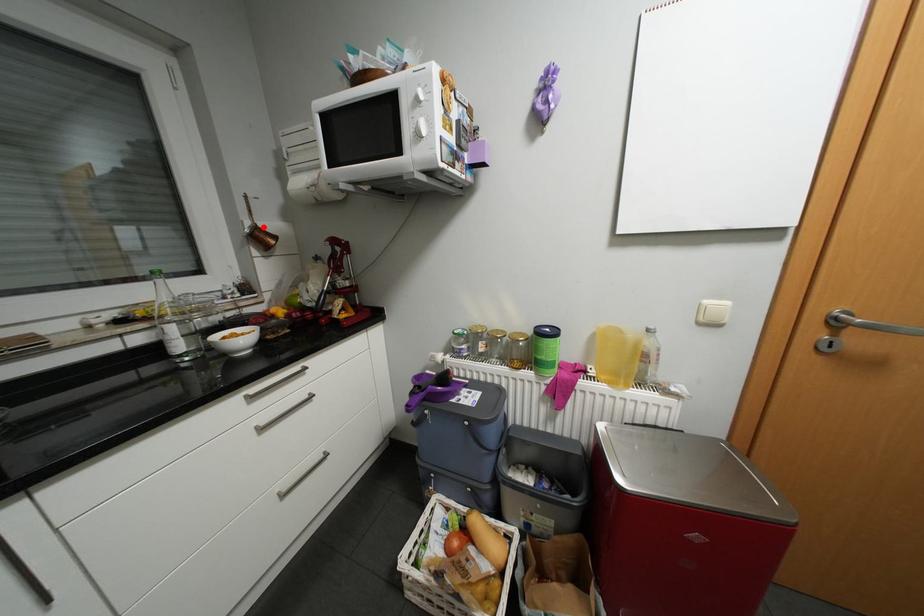
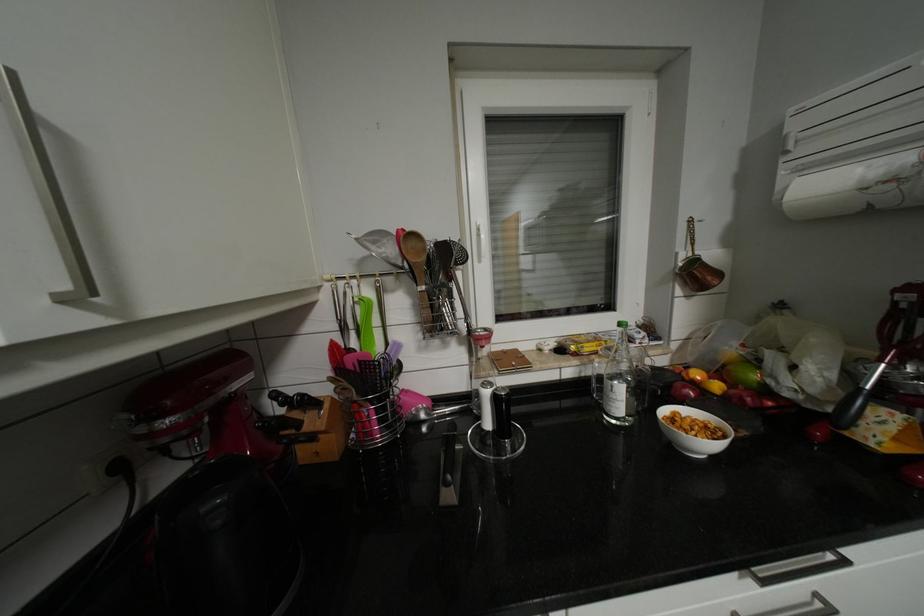
Locate, in the second image, the point that corresponds to the highlighted location in the first image.

(702, 261)